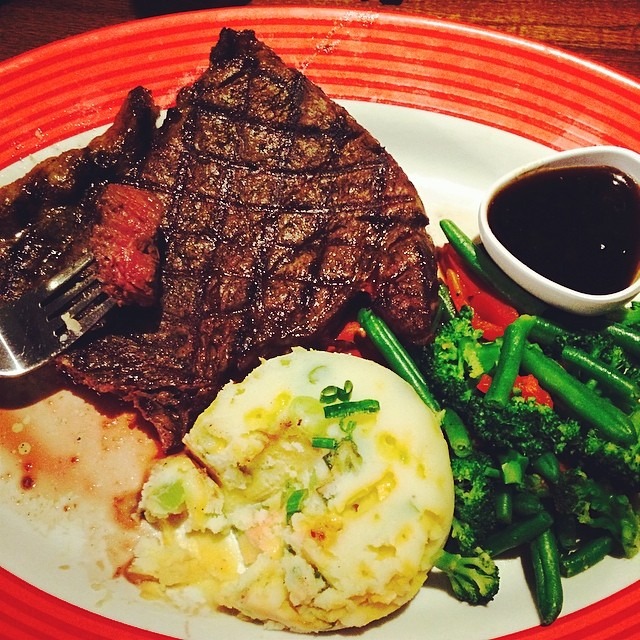
Locate an element on the screen. This screenshot has width=640, height=640. white sauce cup is located at coordinates (534, 278).